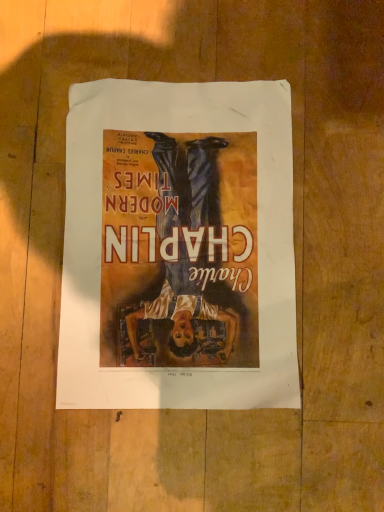
I want to click on empty space that is ontop of matte paper poster at center (from a real-world perspective), so click(x=184, y=258).